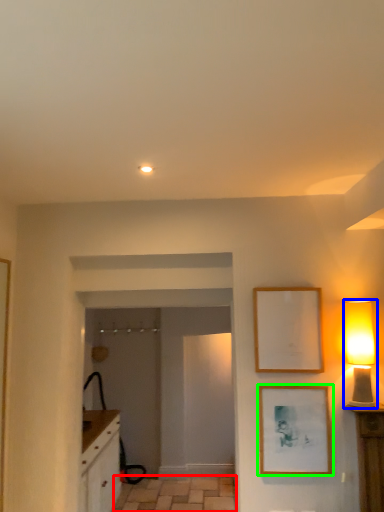
Question: Considering the real-world distances, which object is farthest from tile (highlighted by a red box)? table lamp (highlighted by a blue box) or picture frame (highlighted by a green box)?

Choices:
 (A) table lamp
 (B) picture frame

Answer: (A)